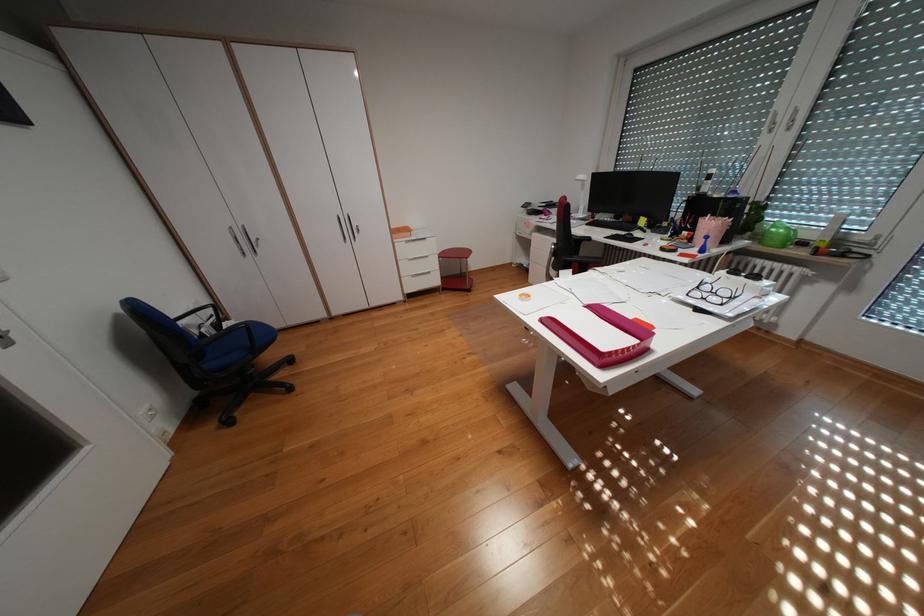
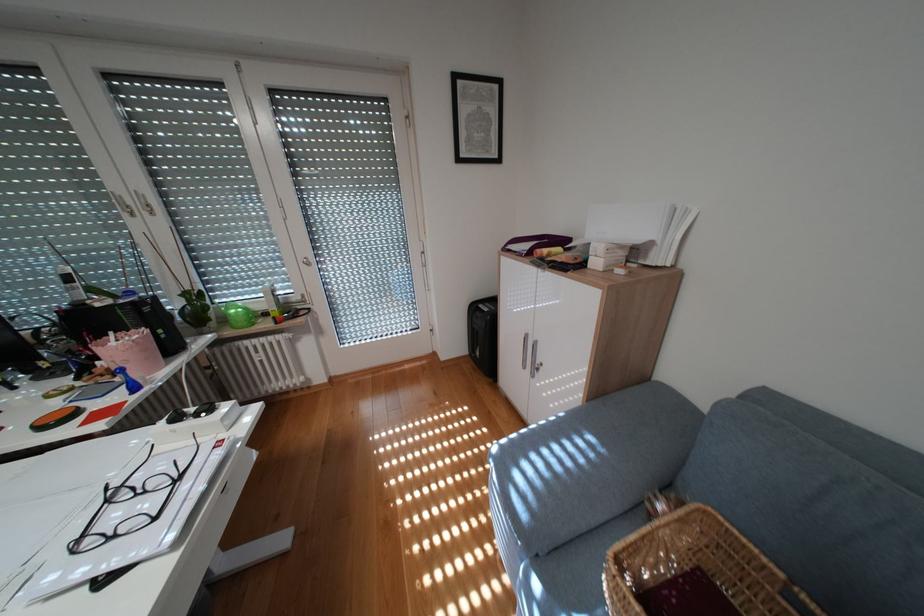
Find the pixel in the second image that matches the point at 745,273 in the first image.

(188, 418)